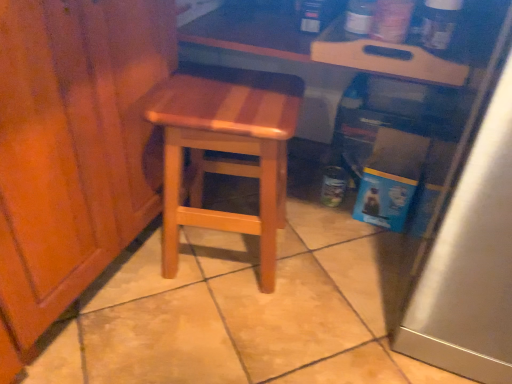
Find the location of a particular element. wooden tray at upper center is located at coordinates (352, 44).

Image resolution: width=512 pixels, height=384 pixels. What do you see at coordinates (352, 44) in the screenshot?
I see `wooden tray at upper center` at bounding box center [352, 44].

This screenshot has height=384, width=512. In order to click on natural wood stool at center in this screenshot , I will do `click(225, 150)`.

What do you see at coordinates (225, 150) in the screenshot? The width and height of the screenshot is (512, 384). I see `natural wood stool at center` at bounding box center [225, 150].

Find the location of `wooden tray at upper center`. wooden tray at upper center is located at coordinates (352, 44).

Does natural wood stool at center appear on the left side of wooden tray at upper center?

Yes.

Considering the relative positions of natural wood stool at center and wooden tray at upper center in the image provided, is natural wood stool at center in front of wooden tray at upper center?

That is True.

Considering the points (165, 90) and (435, 70), which point is behind, point (165, 90) or point (435, 70)?

The point (165, 90) is more distant.

From the image's perspective, is natural wood stool at center located beneath wooden tray at upper center?

Indeed, from the image's perspective, natural wood stool at center is shown beneath wooden tray at upper center.

From a real-world perspective, is natural wood stool at center beneath wooden tray at upper center?

Yes, from a real-world perspective, natural wood stool at center is below wooden tray at upper center.

Looking at their sizes, would you say natural wood stool at center is wider or thinner than wooden tray at upper center?

natural wood stool at center is thinner than wooden tray at upper center.

Is natural wood stool at center shorter than wooden tray at upper center?

In fact, natural wood stool at center may be taller than wooden tray at upper center.

Who is bigger, natural wood stool at center or wooden tray at upper center?

With larger size is natural wood stool at center.

From the picture: Is wooden tray at upper center completely or partially inside natural wood stool at center?

That's incorrect, wooden tray at upper center is not inside natural wood stool at center.

Is natural wood stool at center touching wooden tray at upper center?

No, natural wood stool at center is not beside wooden tray at upper center.

Is natural wood stool at center turned away from wooden tray at upper center?

No, natural wood stool at center is not facing away from wooden tray at upper center.

Can you tell me how much natural wood stool at center and wooden tray at upper center differ in facing direction?

The angular difference between natural wood stool at center and wooden tray at upper center is 169 degrees.

How much distance is there between natural wood stool at center and wooden tray at upper center?

22.52 centimeters.

Find the location of a particular element. Image resolution: width=512 pixels, height=384 pixels. counter behind the natural wood stool at center is located at coordinates (352, 44).

Looking at this image, is wooden tray at upper center at the right side of natural wood stool at center?

Correct, you'll find wooden tray at upper center to the right of natural wood stool at center.

Which object is closer to the camera, wooden tray at upper center or natural wood stool at center?

natural wood stool at center is more forward.

Does point (263, 53) come closer to viewer compared to point (177, 247)?

Yes.

From the image's perspective, between wooden tray at upper center and natural wood stool at center, which one is located above?

wooden tray at upper center, from the image's perspective.

From a real-world perspective, between wooden tray at upper center and natural wood stool at center, who is vertically higher?

wooden tray at upper center, from a real-world perspective.

Is wooden tray at upper center thinner than natural wood stool at center?

No.

Does wooden tray at upper center have a lesser height compared to natural wood stool at center?

Correct, wooden tray at upper center is not as tall as natural wood stool at center.

Does wooden tray at upper center have a larger size compared to natural wood stool at center?

Incorrect, wooden tray at upper center is not larger than natural wood stool at center.

Would you say wooden tray at upper center is inside or outside natural wood stool at center?

wooden tray at upper center exists outside the volume of natural wood stool at center.

Is wooden tray at upper center touching natural wood stool at center?

wooden tray at upper center is not next to natural wood stool at center, and they're not touching.

Is natural wood stool at center at the back of wooden tray at upper center?

No, natural wood stool at center is not at the back of wooden tray at upper center.

How different are the orientations of wooden tray at upper center and natural wood stool at center in degrees?

The angle between the facing direction of wooden tray at upper center and the facing direction of natural wood stool at center is 169 degrees.

Locate an element on the screen. This screenshot has height=384, width=512. stool below the wooden tray at upper center (from the image's perspective) is located at coordinates (225, 150).

Locate an element on the screen. This screenshot has height=384, width=512. counter to the right of natural wood stool at center is located at coordinates (352, 44).

Locate an element on the screen. stool on the left of wooden tray at upper center is located at coordinates (225, 150).